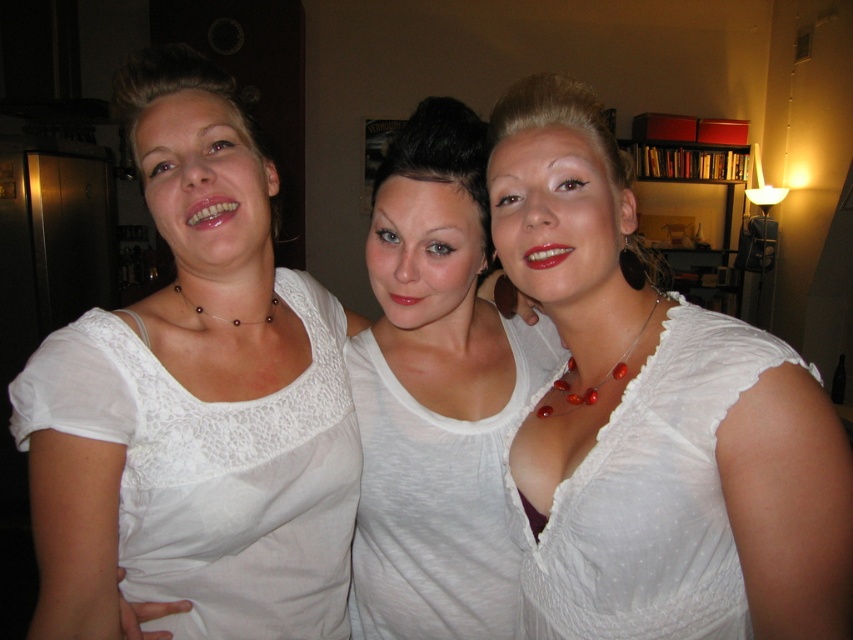
You are standing in the room and want to hand a necklace to the person wearing the white lace top at center. Which direction should you move to reach them?

The white lace top at center is located at point (436, 394), so you should move towards the center of the room to reach them.